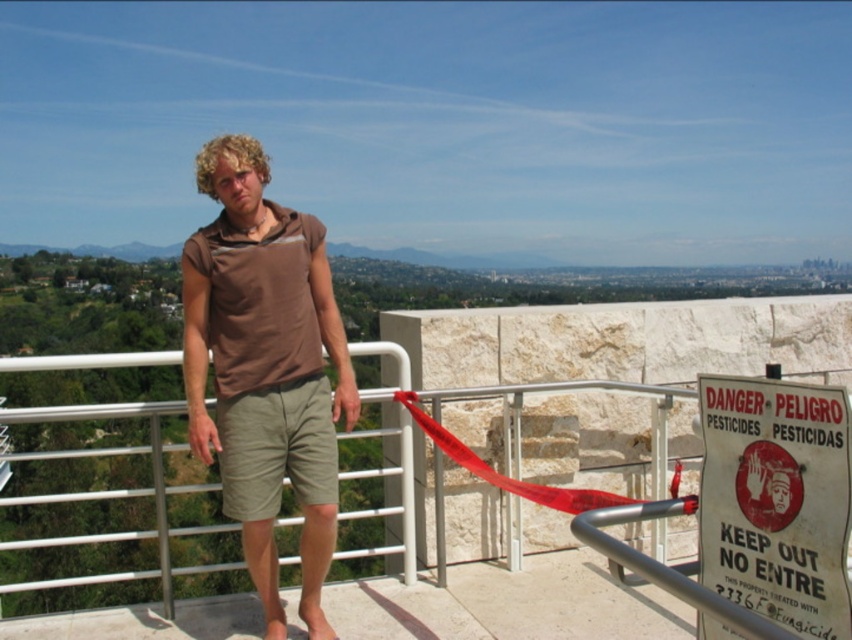
Who is positioned more to the right, brown cotton shirt at center or red fabric ribbon at center?

Positioned to the right is red fabric ribbon at center.

Between brown cotton shirt at center and red fabric ribbon at center, which one is positioned lower?

red fabric ribbon at center is below.

This screenshot has width=852, height=640. What are the coordinates of `brown cotton shirt at center` in the screenshot? It's located at (265, 369).

How much distance is there between brown cotton shirt at center and white paper sign at right?

A distance of 1.96 meters exists between brown cotton shirt at center and white paper sign at right.

Is point (321, 400) positioned after point (700, 509)?

Yes.

Find the location of a particular element. brown cotton shirt at center is located at coordinates (265, 369).

Image resolution: width=852 pixels, height=640 pixels. Describe the element at coordinates (776, 500) in the screenshot. I see `white paper sign at right` at that location.

Is white paper sign at right further to the viewer compared to red fabric ribbon at center?

That is False.

Image resolution: width=852 pixels, height=640 pixels. What do you see at coordinates (776, 500) in the screenshot?
I see `white paper sign at right` at bounding box center [776, 500].

Where is `white paper sign at right`? The width and height of the screenshot is (852, 640). white paper sign at right is located at coordinates (776, 500).